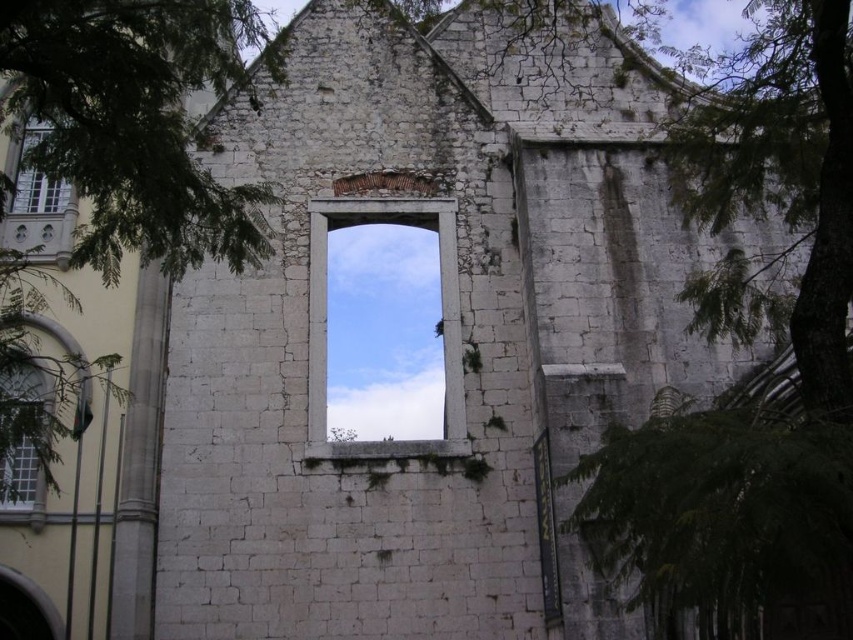
You are standing in front of an old stone building with two points marked on it. The first point is at coordinates point (840, 397) and the second is at point (6, 362). Which point is closer to you?

Point (840, 397) is in front of point (6, 362), so the first point is closer to you.

You are a painter standing in front of the old stone building. You want to paint the green leafy tree at right and the clear glass window at lower left. Which object should you look up to paint?

The green leafy tree at right is located above the clear glass window at lower left, so you should look up to paint the green leafy tree at right.

You are an architect examining the old stone building. You notice the white stone window at center and the matte glass window at upper left. Which of these two windows is located higher up in the building?

The matte glass window at upper left is located higher up in the building because the white stone window at center is positioned under it.